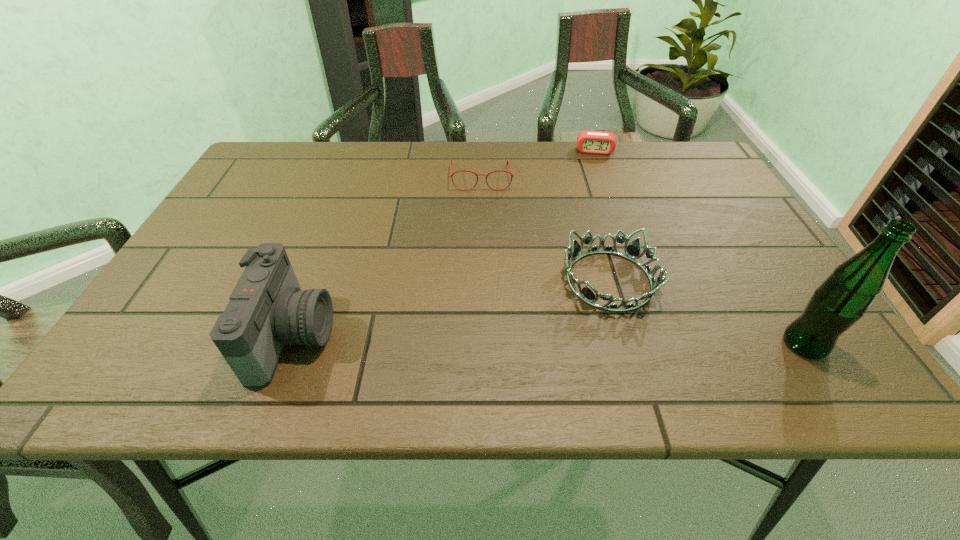
At what (x,y) coordinates should I click in order to perform the action: click on free location that satisfies the following two spatial constraints: 1. on the back side of the farthest object; 2. on the right side of the fourth nearest object. Please return your answer as a coordinate pair (x, y). Looking at the image, I should click on (481, 151).

I want to click on vacant space that satisfies the following two spatial constraints: 1. on the back side of the farthest object; 2. on the left side of the third tallest object, so click(572, 151).